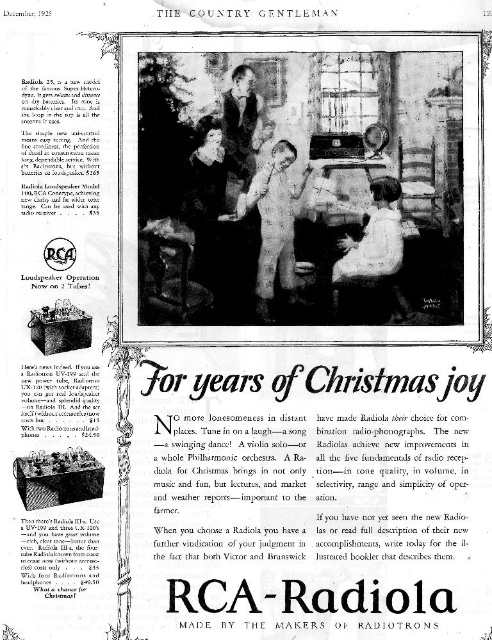
Can you confirm if white cotton overalls at center is bigger than smooth leather jacket at center?

Correct, white cotton overalls at center is larger in size than smooth leather jacket at center.

Can you confirm if white cotton overalls at center is wider than smooth leather jacket at center?

Correct, the width of white cotton overalls at center exceeds that of smooth leather jacket at center.

Measure the distance between white cotton overalls at center and camera.

A distance of 22.80 meters exists between white cotton overalls at center and camera.

At what (x,y) coordinates should I click in order to perform the action: click on white cotton overalls at center. Please return your answer as a coordinate pair (x, y). This screenshot has width=492, height=640. Looking at the image, I should click on (275, 225).

Can you confirm if white cotton shirt at center is wider than white cotton overalls at center?

Indeed, white cotton shirt at center has a greater width compared to white cotton overalls at center.

Which is in front, point (375, 205) or point (285, 272)?

Positioned in front is point (375, 205).

Identify the location of white cotton shirt at center. (375, 257).

Between white cotton shirt at center and smooth leather jacket at center, which one is positioned lower?

white cotton shirt at center is lower down.

Does white cotton shirt at center have a lesser width compared to smooth leather jacket at center?

No, white cotton shirt at center is not thinner than smooth leather jacket at center.

Measure the distance between white cotton shirt at center and camera.

white cotton shirt at center and camera are 74.85 feet apart from each other.

Where is `white cotton shirt at center`? This screenshot has height=640, width=492. white cotton shirt at center is located at coordinates (375, 257).